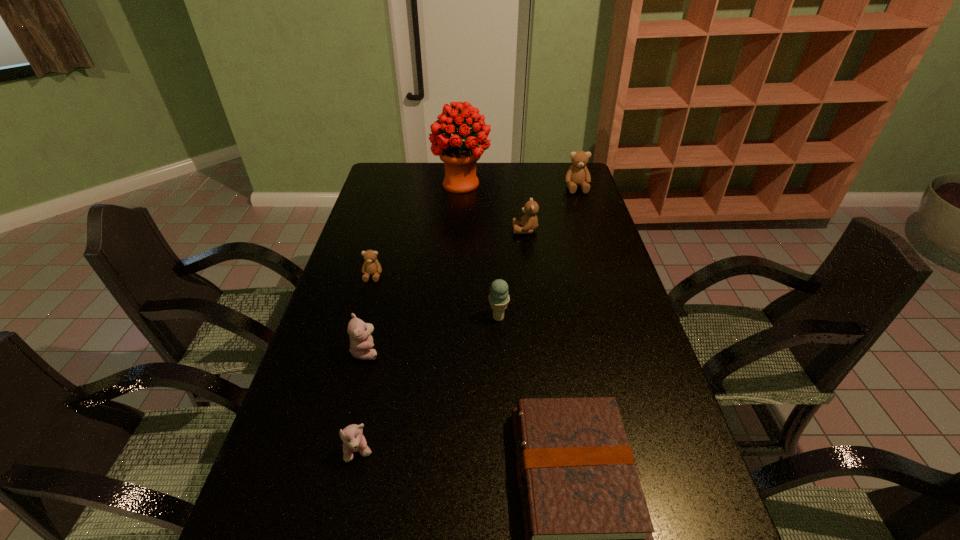
Identify the location of brown teddy bear object that ranks as the third closest to the bigger pink teddy bear. The height and width of the screenshot is (540, 960). (577, 175).

Where is `brown teddy bear that stands as the second closest to the ice cream`? The height and width of the screenshot is (540, 960). brown teddy bear that stands as the second closest to the ice cream is located at coordinates (529, 222).

What are the coordinates of `blank space that satisfies the following two spatial constraints: 1. on the front-facing side of the rightmost object; 2. at the face of the farther pink teddy bear` in the screenshot? It's located at (630, 351).